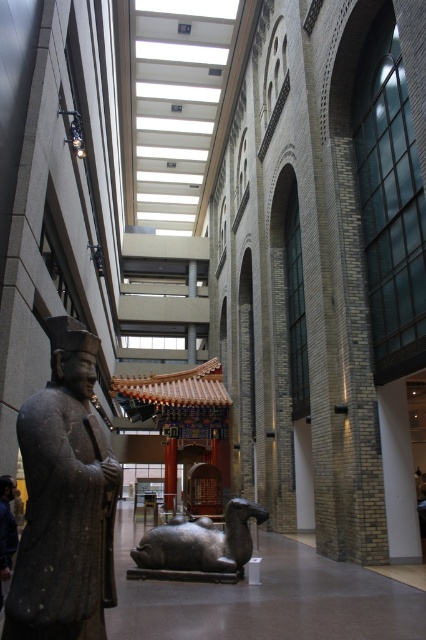
In order to click on polished bronze statue at center in this screenshot , I will do `click(198, 547)`.

Consider the image. Is polished bronze statue at center to the left of dark gray stone statue at left from the viewer's perspective?

Incorrect, polished bronze statue at center is not on the left side of dark gray stone statue at left.

Is point (201, 525) closer to camera compared to point (5, 564)?

That is False.

At what (x,y) coordinates should I click in order to perform the action: click on polished bronze statue at center. Please return your answer as a coordinate pair (x, y). This screenshot has height=640, width=426. Looking at the image, I should click on (198, 547).

Does matte gray statue at left have a larger size compared to polished bronze statue at center?

Correct, matte gray statue at left is larger in size than polished bronze statue at center.

This screenshot has height=640, width=426. I want to click on matte gray statue at left, so click(x=65, y=500).

The image size is (426, 640). Find the location of `matte gray statue at left`. matte gray statue at left is located at coordinates (65, 500).

How far apart are matte gray statue at left and dark gray stone statue at left?

The distance of matte gray statue at left from dark gray stone statue at left is 24.70 feet.

Is point (80, 486) positioned after point (2, 579)?

No, it is not.

Is point (91, 548) behind point (14, 518)?

No, (91, 548) is in front of (14, 518).

I want to click on matte gray statue at left, so click(65, 500).